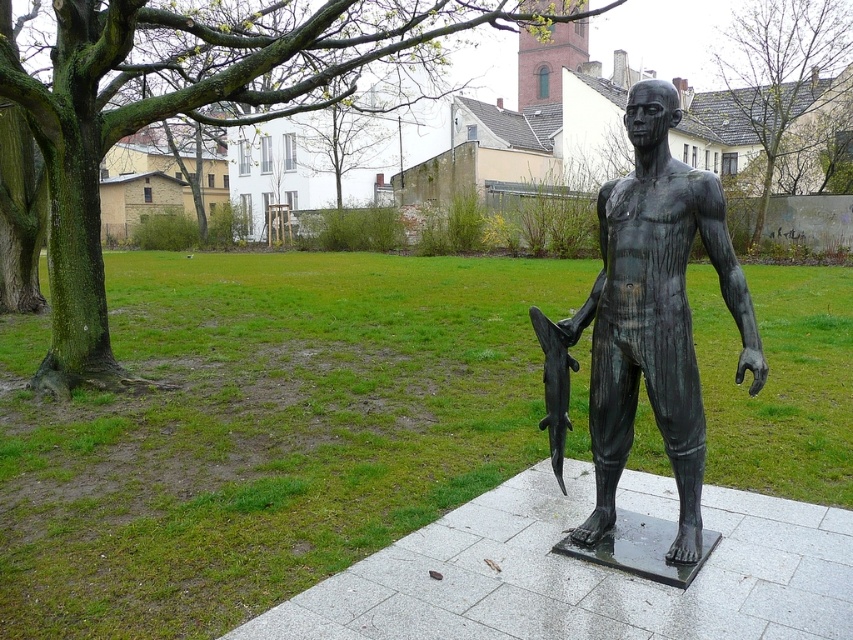
You are a visitor at an outdoor sculpture garden. You see the bronze statue at center and the polished bronze shark at lower right. Which one is positioned higher in the scene?

The bronze statue at center is positioned higher than the polished bronze shark at lower right because it is located above it.

You are an art student trying to sketch the scene. You need to decide which object to draw first based on their sizes. Which one should you start with, the bronze statue at center or the polished bronze shark at lower right?

The bronze statue at center is larger in size than the polished bronze shark at lower right, so you should start with the bronze statue at center to ensure proper proportions in your sketch.